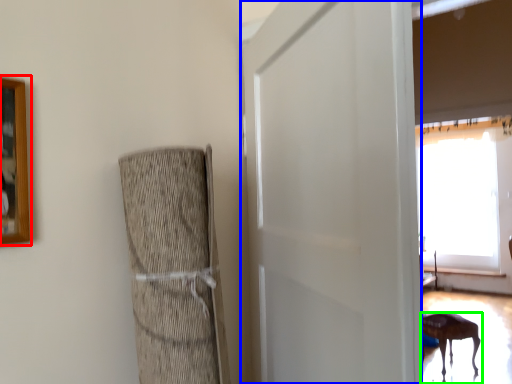
Question: Estimate the real-world distances between objects in this image. Which object is farther from picture frame (highlighted by a red box), screen door (highlighted by a blue box) or furniture (highlighted by a green box)?

Choices:
 (A) screen door
 (B) furniture

Answer: (B)